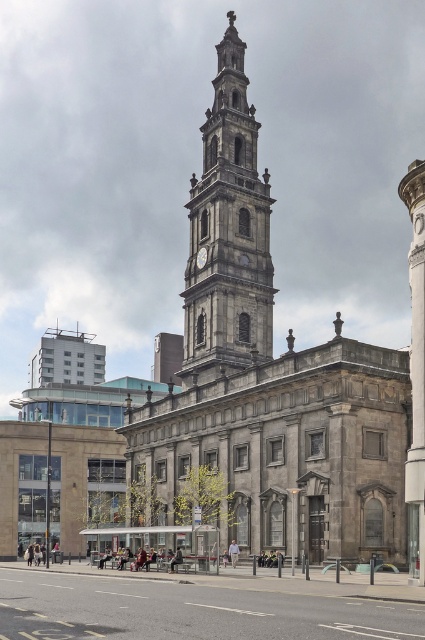
In the scene shown: Between stone clock tower at center and gold metallic clock at center, which one appears on the left side from the viewer's perspective?

gold metallic clock at center is more to the left.

The width and height of the screenshot is (425, 640). Describe the element at coordinates (227, 234) in the screenshot. I see `stone clock tower at center` at that location.

Where is `stone clock tower at center`? This screenshot has height=640, width=425. stone clock tower at center is located at coordinates (227, 234).

You are a GUI agent. You are given a task and a screenshot of the screen. Output one action in this format:
    pyautogui.click(x=<x>, y=<y>)
    Task: Click on the stone clock tower at center
    
    Given the screenshot: What is the action you would take?
    pyautogui.click(x=227, y=234)

Is gray stone church at center further to camera compared to concrete pavement at lower center?

Yes, it is.

Which is above, gray stone church at center or concrete pavement at lower center?

Positioned higher is gray stone church at center.

Is point (226, 72) farther from viewer compared to point (190, 600)?

Yes, it is behind point (190, 600).

Where is `gray stone church at center`? gray stone church at center is located at coordinates (268, 380).

Can you confirm if gray stone church at center is thinner than stone clock tower at center?

No, gray stone church at center is not thinner than stone clock tower at center.

Is point (291, 355) closer to viewer compared to point (234, 36)?

Yes.

You are a GUI agent. You are given a task and a screenshot of the screen. Output one action in this format:
    pyautogui.click(x=<x>, y=<y>)
    Task: Click on the gray stone church at center
    This screenshot has width=425, height=640.
    Given the screenshot: What is the action you would take?
    pyautogui.click(x=268, y=380)

The image size is (425, 640). Identify the location of gray stone church at center. (268, 380).